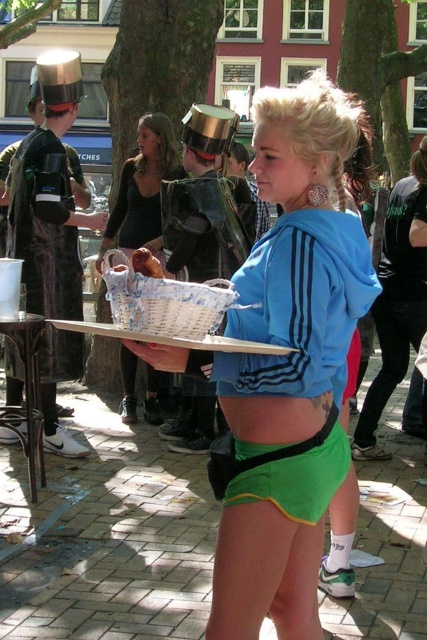
Question: Which of the following is the closest to the observer?

Choices:
 (A) (151, 276)
 (B) (169, 150)
 (C) (63, 244)
 (D) (322, 429)

Answer: (A)

Question: Where is brushed metal hat at upper left located in relation to breadsoftbasket at center in the image?

Choices:
 (A) left
 (B) right

Answer: (A)

Question: Which point is farther to the camera?

Choices:
 (A) (58, 336)
 (B) (158, 262)
 (C) (113, 205)
 (D) (271, 260)

Answer: (C)

Question: Where is brushed metal hat at upper left located in relation to breadsoftbasket at center in the image?

Choices:
 (A) left
 (B) right

Answer: (A)

Question: Does brushed metal hat at upper left lie behind matte black basket at center?

Choices:
 (A) yes
 (B) no

Answer: (B)

Question: Considering the real-world distances, which object is closest to the matte black basket at center?

Choices:
 (A) breadsoftbasket at center
 (B) brushed metal hat at upper left

Answer: (B)